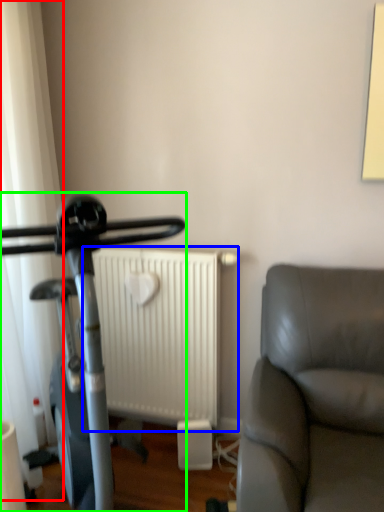
Question: Which is nearer to the curtain (highlighted by a red box)? radiator (highlighted by a blue box) or stationary bicycle (highlighted by a green box).

Choices:
 (A) radiator
 (B) stationary bicycle

Answer: (B)